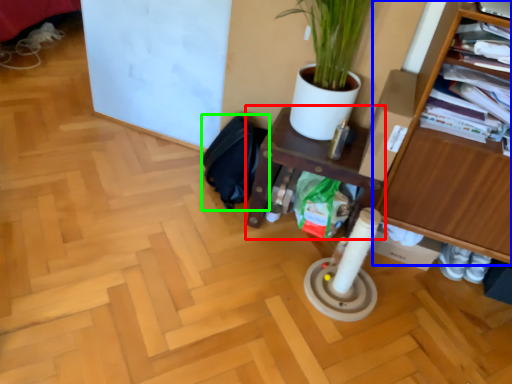
Question: Based on their relative distances, which object is farther from shelf (highlighted by a red box)? Choose from furniture (highlighted by a blue box) and swivel chair (highlighted by a green box).

Choices:
 (A) furniture
 (B) swivel chair

Answer: (A)